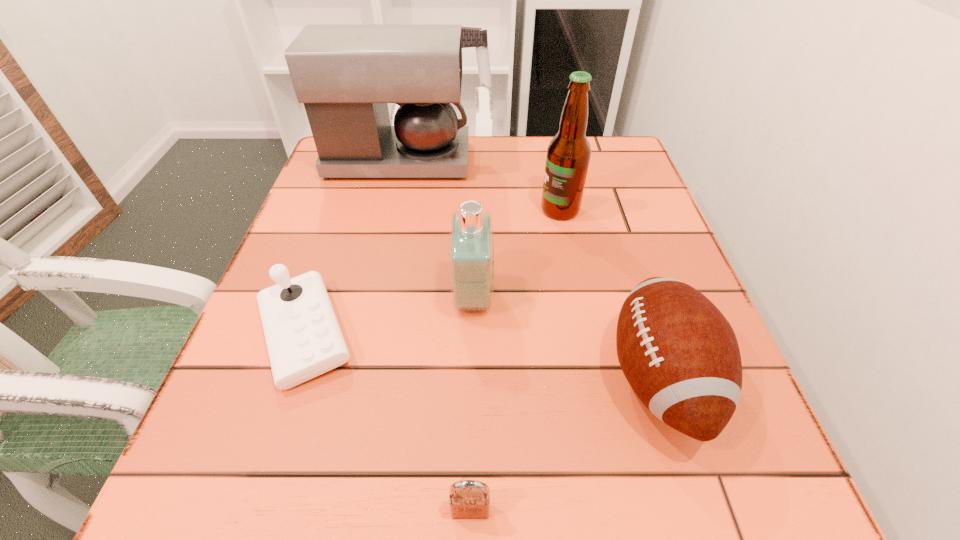
At what (x,y) coordinates should I click in order to perform the action: click on the fifth closest object to the nearest object. Please return your answer as a coordinate pair (x, y). This screenshot has height=540, width=960. Looking at the image, I should click on (345, 75).

Select which object is the fifth closest to the farthest object. Please provide its 2D coordinates. Your answer should be formatted as a tuple, i.e. [(x, y)], where the tuple contains the x and y coordinates of a point satisfying the conditions above.

[(469, 499)]

Identify the location of free space that satisfies the following two spatial constraints: 1. on the laces of the fourth tallest object; 2. on the front-facing side of the padlock. (702, 511).

I want to click on free location that satisfies the following two spatial constraints: 1. on the label of the beer bottle; 2. on the front side of the joystick, so click(586, 334).

Where is `vacant area in the image that satisfies the following two spatial constraints: 1. on the laces of the football; 2. on the front-facing side of the nearest object`? The image size is (960, 540). vacant area in the image that satisfies the following two spatial constraints: 1. on the laces of the football; 2. on the front-facing side of the nearest object is located at coordinates (702, 511).